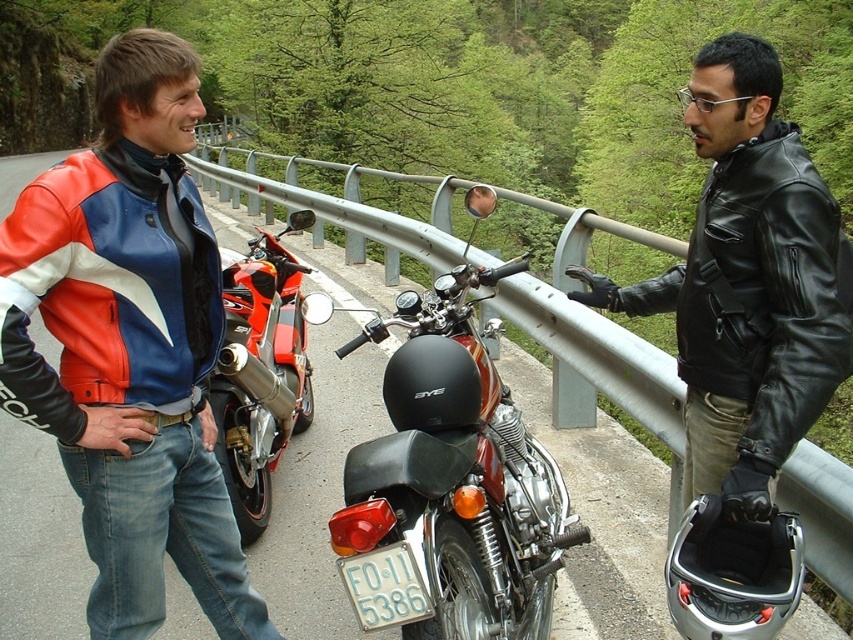
Question: Does shiny chrome motorcycle at center appear over shiny red sportbike at left?

Choices:
 (A) no
 (B) yes

Answer: (A)

Question: Which of these objects is positioned closest to the shiny chrome motorcycle at center?

Choices:
 (A) white plastic license plate at center
 (B) leather jacket at left
 (C) black leather jacket at center

Answer: (A)

Question: Is leather jacket at left to the left of white plastic license plate at center from the viewer's perspective?

Choices:
 (A) yes
 (B) no

Answer: (A)

Question: Is leather jacket at left to the right of white plastic license plate at center from the viewer's perspective?

Choices:
 (A) no
 (B) yes

Answer: (A)

Question: Which point is closer to the camera?

Choices:
 (A) (271, 356)
 (B) (450, 348)
 (C) (364, 630)

Answer: (C)

Question: Which of these objects is positioned farthest from the leather jacket at left?

Choices:
 (A) shiny red sportbike at left
 (B) shiny chrome motorcycle at center
 (C) white plastic license plate at center

Answer: (A)